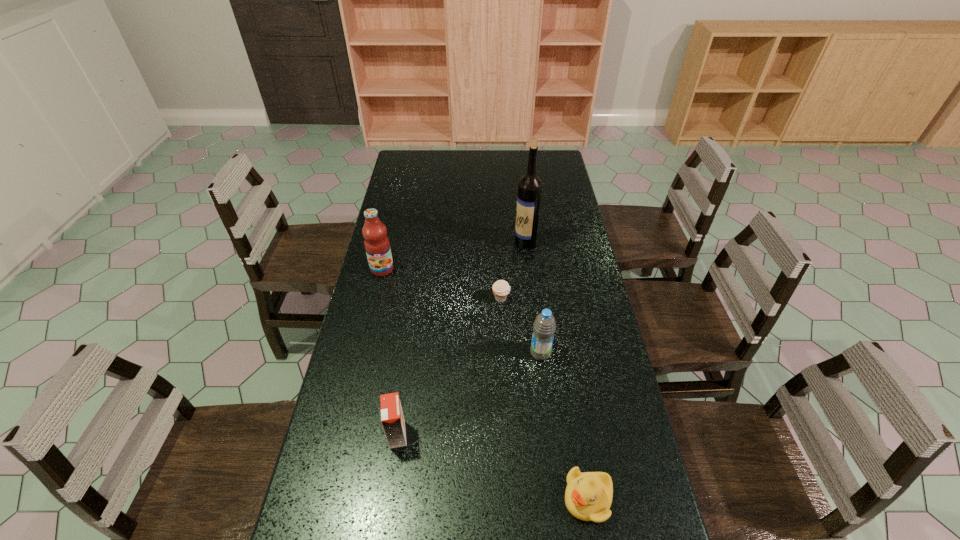
Find the location of a particular element. Image resolution: width=960 pixels, height=540 pixels. free space that satisfies the following two spatial constraints: 1. on the front label of the second tallest object; 2. on the left side of the fourth nearest object is located at coordinates [375, 298].

The height and width of the screenshot is (540, 960). I want to click on free space that satisfies the following two spatial constraints: 1. on the front label of the third nearest object; 2. on the right side of the fifth shortest object, so click(x=363, y=353).

This screenshot has width=960, height=540. I want to click on vacant space that satisfies the following two spatial constraints: 1. on the front label of the second farthest object; 2. on the left side of the water bottle, so (x=363, y=353).

Where is `vacant area in the image that satisfies the following two spatial constraints: 1. on the front label of the water bottle; 2. on the left side of the fifth nearest object`? vacant area in the image that satisfies the following two spatial constraints: 1. on the front label of the water bottle; 2. on the left side of the fifth nearest object is located at coordinates point(363,353).

Where is `free spot that satisfies the following two spatial constraints: 1. on the front label of the orange juice; 2. on the left side of the fruit juice`? Image resolution: width=960 pixels, height=540 pixels. free spot that satisfies the following two spatial constraints: 1. on the front label of the orange juice; 2. on the left side of the fruit juice is located at coordinates (344, 435).

Where is `vacant area in the image that satisfies the following two spatial constraints: 1. on the front label of the third nearest object; 2. on the left side of the leftmost object`? This screenshot has height=540, width=960. vacant area in the image that satisfies the following two spatial constraints: 1. on the front label of the third nearest object; 2. on the left side of the leftmost object is located at coordinates (363, 353).

The image size is (960, 540). I want to click on free location that satisfies the following two spatial constraints: 1. on the front side of the water bottle; 2. on the left side of the fourth object from right to left, so click(x=504, y=353).